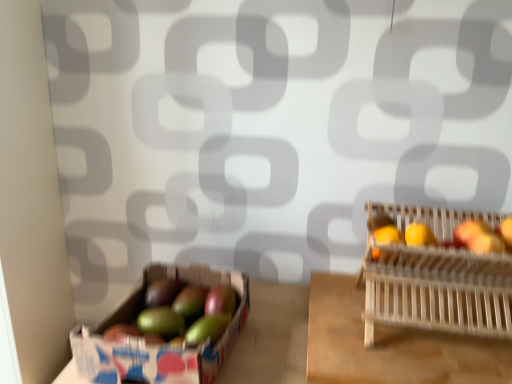
Question: In terms of width, does wooden slatted basket at right look wider or thinner when compared to shiny red apple at right, which is the 2th apple from right to left?

Choices:
 (A) thin
 (B) wide

Answer: (B)

Question: In the image, is wooden slatted basket at right positioned in front of or behind shiny red apple at right, which is the 2th apple from right to left?

Choices:
 (A) behind
 (B) front

Answer: (B)

Question: Based on their relative distances, which object is nearer to the green matte mango at lower left, positioned as the second apple in left-to-right order?

Choices:
 (A) green matte apple at center, which is the 3th apple from right to left
 (B) shiny red apple at right, placed as the first apple when sorted from right to left
 (C) green matte avocado at lower left, arranged as the 5th apple when viewed from the right
 (D) shiny red apple at right, which is the 2th apple from right to left
 (E) wooden slatted basket at right

Answer: (C)

Question: Which object is positioned farthest from the shiny red apple at right, the fourth apple viewed from the left?

Choices:
 (A) shiny red apple at right, placed as the first apple when sorted from right to left
 (B) green matte apple at center, which is the 3th apple from right to left
 (C) wooden slatted basket at right
 (D) green matte mango at lower left, positioned as the second apple in left-to-right order
 (E) green matte avocado at lower left, arranged as the 5th apple when viewed from the right

Answer: (E)